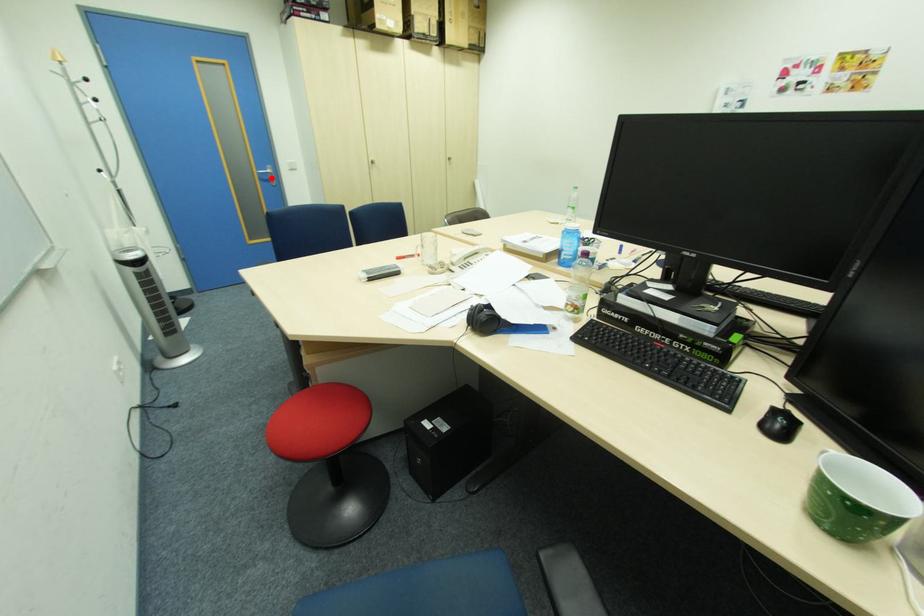
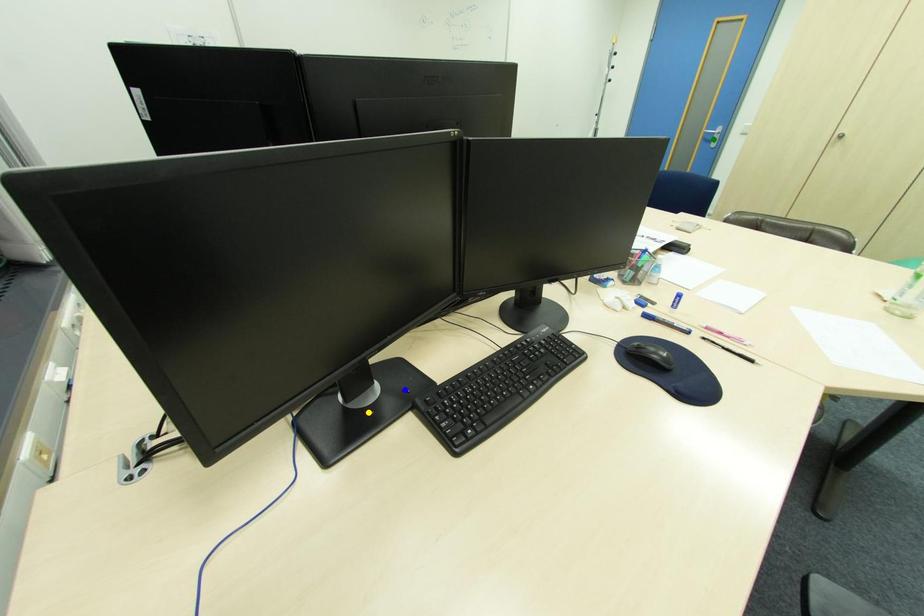
Question: I am providing you with two images of the same scene from different viewpoints. A red point is marked on the first image. You are given multiple points on the second image. Which point in image 2 represents the same 3d spot as the red point in image 1?

Choices:
 (A) blue point
 (B) green point
 (C) yellow point

Answer: (B)